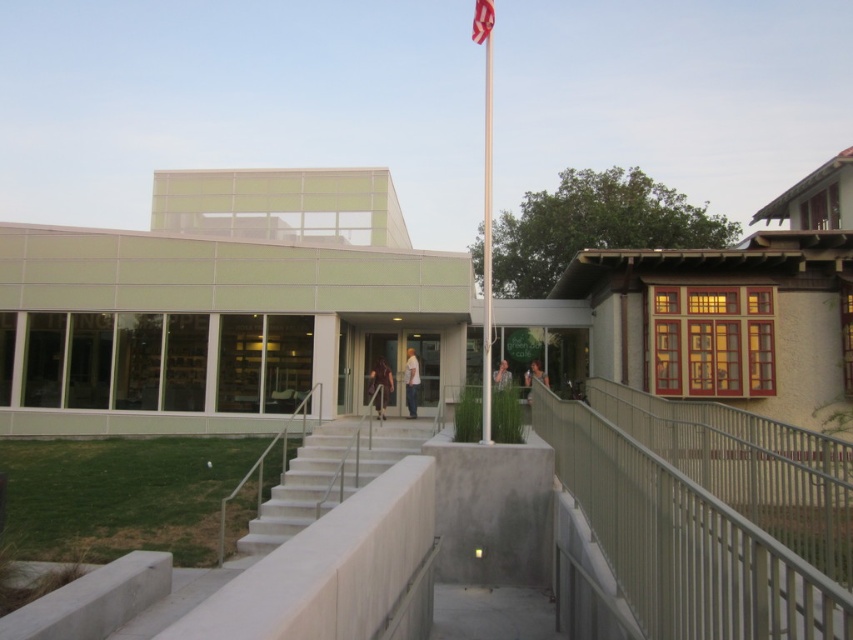
You are standing at the entrance of the modern building with a white cotton shirt at center in your view. You need to reach the shirt quickly. Is the shirt close enough for you to grab it within 10 seconds if you walk at a normal pace?

The white cotton shirt at center is 51.69 feet away from the camera. Walking at a normal pace of about 3 feet per second, it would take approximately 17.23 seconds to reach it. Therefore, you cannot grab the shirt within 10 seconds.

You are standing in the middle of the walkway between the two buildings and notice a polished metal flag pole at center and a white cotton shirt at center. Which object is located to the right of the other?

The polished metal flag pole at center is positioned on the right side of white cotton shirt at center.

You are a visitor approaching the entrance of the building with the light green facade. You notice the metallic gray railing at lower right and the polished metal flag pole at center. Which object is closer to the ground level?

The metallic gray railing at lower right is closer to the ground level because it is positioned below the polished metal flag pole at center.